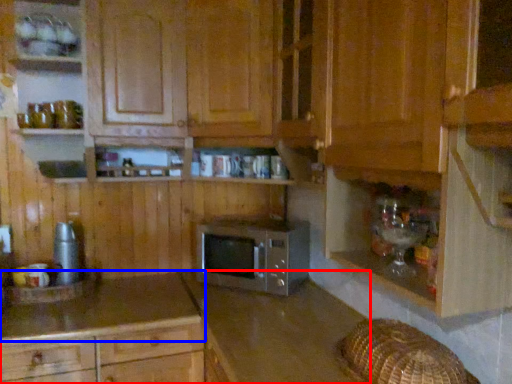
Question: Which point is closer to the camera, cabinetry (highlighted by a red box) or countertop (highlighted by a blue box)?

Choices:
 (A) cabinetry
 (B) countertop

Answer: (A)